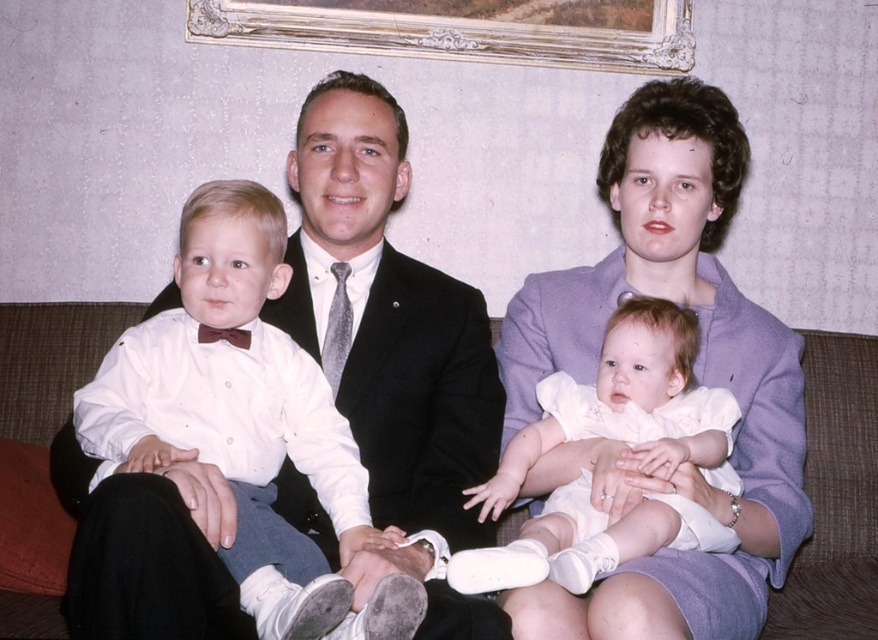
Question: Which object appears farthest from the camera in this image?

Choices:
 (A) brown fabric couch at center
 (B) white satin dress at center
 (C) purple fabric dress at center

Answer: (A)

Question: Which object is closer to the camera taking this photo?

Choices:
 (A) purple fabric dress at center
 (B) brown fabric couch at center

Answer: (A)

Question: Does matte black suit at center appear over purple fabric dress at center?

Choices:
 (A) no
 (B) yes

Answer: (A)

Question: Which point is closer to the camera?

Choices:
 (A) white satin dress at center
 (B) brown fabric couch at center
 (C) matte black suit at center

Answer: (C)

Question: Does purple fabric dress at center have a larger size compared to white satin dress at center?

Choices:
 (A) no
 (B) yes

Answer: (B)

Question: From the image, what is the correct spatial relationship of matte black suit at center in relation to brown fabric couch at center?

Choices:
 (A) right
 (B) left

Answer: (A)